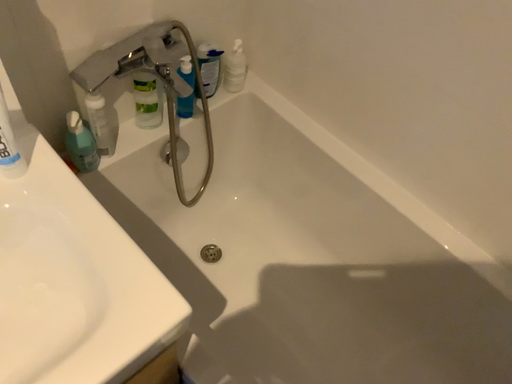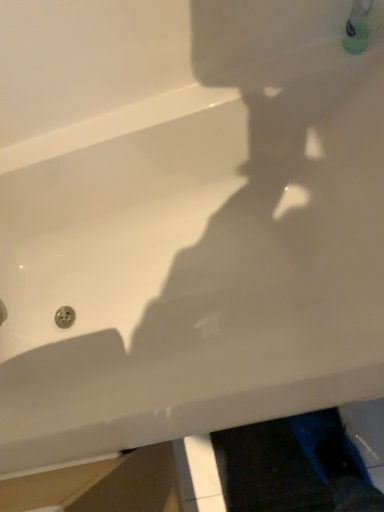
Question: Which way did the camera rotate in the video?

Choices:
 (A) rotated right
 (B) rotated left

Answer: (A)